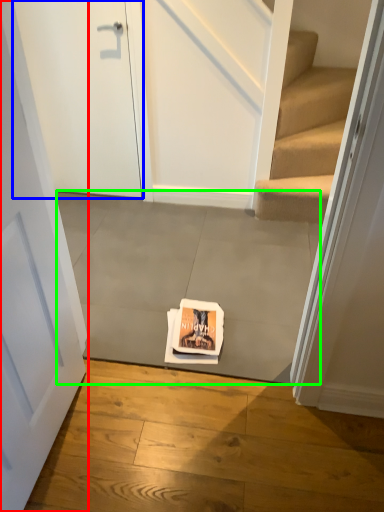
Question: Which is farther away from door (highlighted by a red box)? door (highlighted by a blue box) or concrete (highlighted by a green box)?

Choices:
 (A) door
 (B) concrete

Answer: (A)